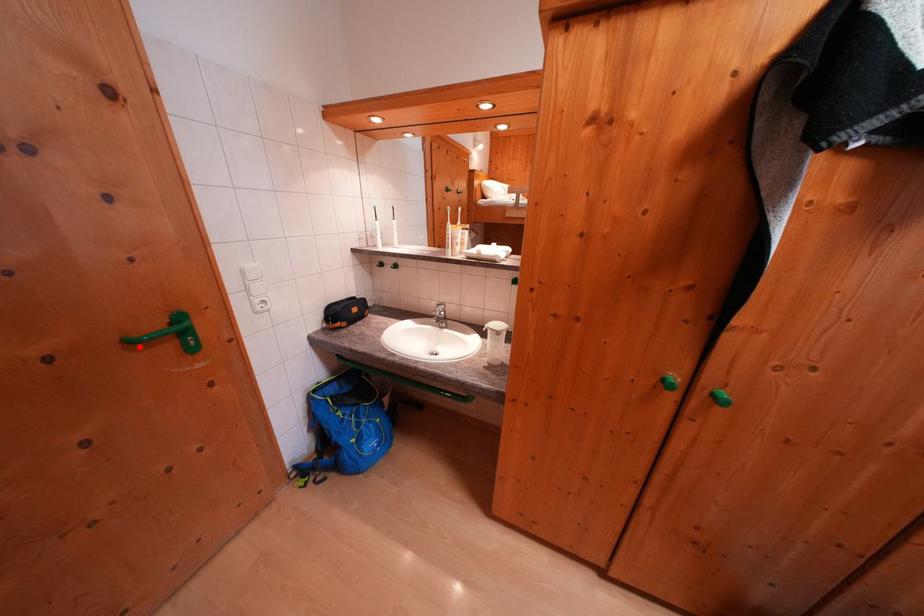
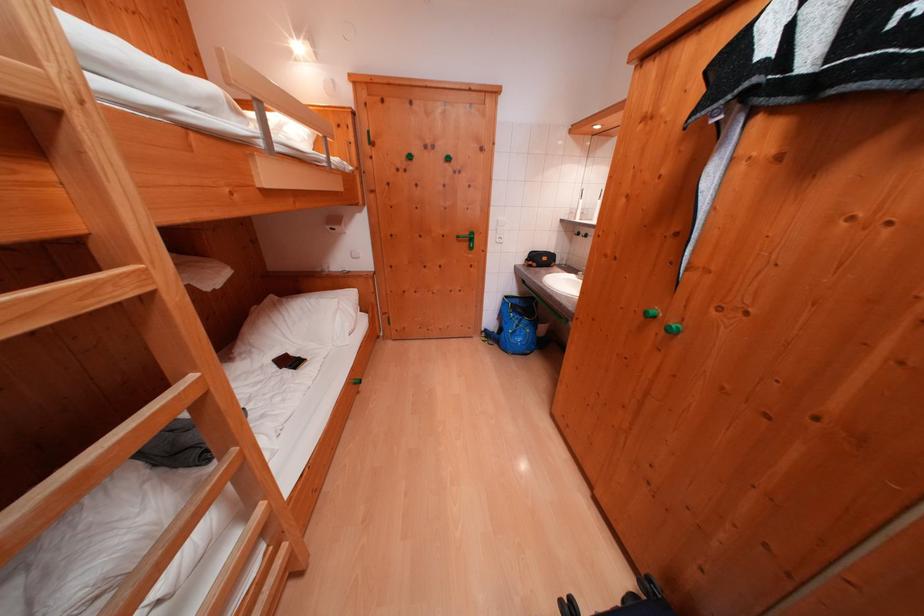
Locate, in the second image, the point that corresponds to the highlighted location in the first image.

(466, 241)